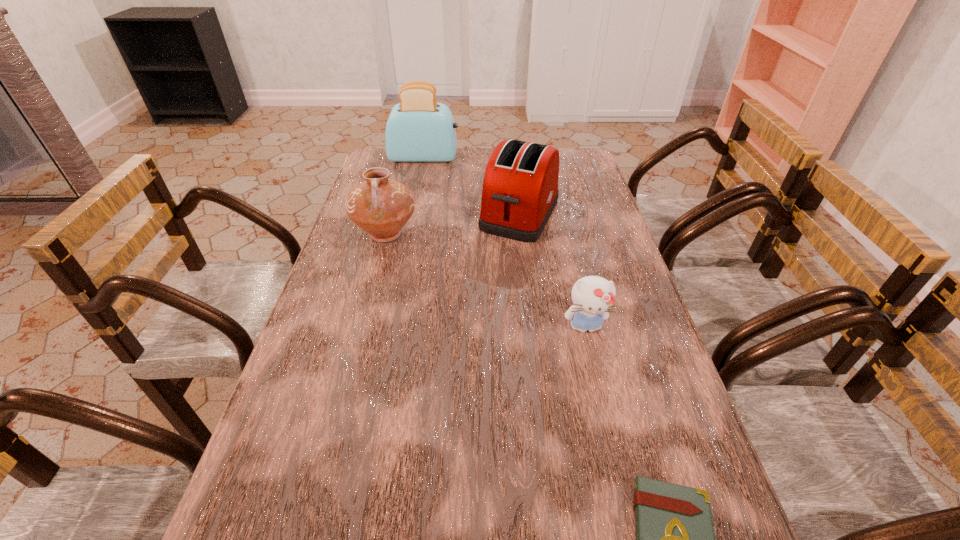
Image resolution: width=960 pixels, height=540 pixels. In the image, there is a desktop. Find the location of `free region at the far right corner`. free region at the far right corner is located at coordinates (566, 165).

The width and height of the screenshot is (960, 540). I want to click on free point between the shorter toaster and the fourth farthest object, so coord(552,271).

Identify the location of vacant space that's between the right toaster and the pottery. This screenshot has height=540, width=960. [x=453, y=224].

Find the location of a particular element. free space between the pottery and the kitten is located at coordinates (486, 281).

Where is `unoccupied position between the nearer toaster and the farthest object`? The width and height of the screenshot is (960, 540). unoccupied position between the nearer toaster and the farthest object is located at coordinates (472, 186).

Find the location of a particular element. The width and height of the screenshot is (960, 540). vacant area between the kitten and the farther toaster is located at coordinates (505, 242).

You are a GUI agent. You are given a task and a screenshot of the screen. Output one action in this format:
    pyautogui.click(x=<x>, y=<y>)
    Task: Click on the free spot between the shorter toaster and the fourth tallest object
    The image size is (960, 540).
    Given the screenshot: What is the action you would take?
    pyautogui.click(x=552, y=271)

Identify the location of free area in between the shorter toaster and the pottery. pyautogui.click(x=453, y=224).

What are the coordinates of `the fourth closest object relative to the nearest object` in the screenshot? It's located at (419, 129).

Where is `the fourth closest object to the shortest object`? This screenshot has height=540, width=960. the fourth closest object to the shortest object is located at coordinates (419, 129).